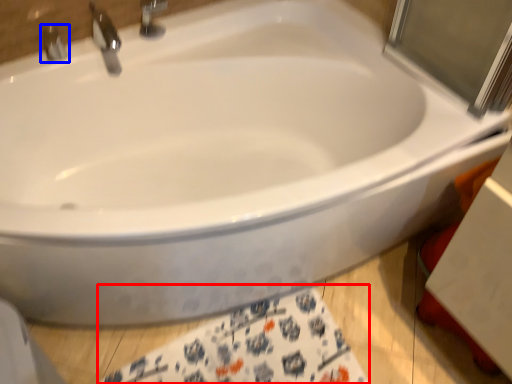
Question: Which of the following is the farthest to the observer, bath towel (highlighted by a red box) or tap (highlighted by a blue box)?

Choices:
 (A) bath towel
 (B) tap

Answer: (B)